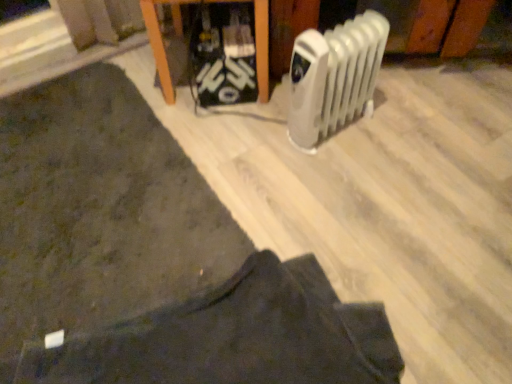
Question: Is white plastic radiator at right beside dark fabric mat at lower left?

Choices:
 (A) no
 (B) yes

Answer: (A)

Question: Can you confirm if white plastic radiator at right is wider than dark fabric mat at lower left?

Choices:
 (A) yes
 (B) no

Answer: (B)

Question: Is dark fabric mat at lower left inside white plastic radiator at right?

Choices:
 (A) no
 (B) yes

Answer: (A)

Question: Is white plastic radiator at right far away from dark fabric mat at lower left?

Choices:
 (A) yes
 (B) no

Answer: (B)

Question: Is the depth of white plastic radiator at right greater than that of dark fabric mat at lower left?

Choices:
 (A) yes
 (B) no

Answer: (A)

Question: From the image's perspective, is white plastic radiator at right under dark fabric mat at lower left?

Choices:
 (A) yes
 (B) no

Answer: (B)

Question: Considering the relative sizes of dark fabric mat at lower left and dark fabric pants at lower center in the image provided, is dark fabric mat at lower left thinner than dark fabric pants at lower center?

Choices:
 (A) no
 (B) yes

Answer: (A)

Question: Is dark fabric mat at lower left to the right of dark fabric pants at lower center from the viewer's perspective?

Choices:
 (A) yes
 (B) no

Answer: (B)

Question: Does dark fabric mat at lower left have a smaller size compared to dark fabric pants at lower center?

Choices:
 (A) yes
 (B) no

Answer: (B)

Question: Is dark fabric mat at lower left shorter than dark fabric pants at lower center?

Choices:
 (A) no
 (B) yes

Answer: (A)

Question: Is dark fabric mat at lower left located outside dark fabric pants at lower center?

Choices:
 (A) no
 (B) yes

Answer: (B)

Question: Is dark fabric mat at lower left oriented away from dark fabric pants at lower center?

Choices:
 (A) yes
 (B) no

Answer: (B)

Question: Is dark fabric pants at lower center positioned with its back to white plastic radiator at right?

Choices:
 (A) yes
 (B) no

Answer: (B)